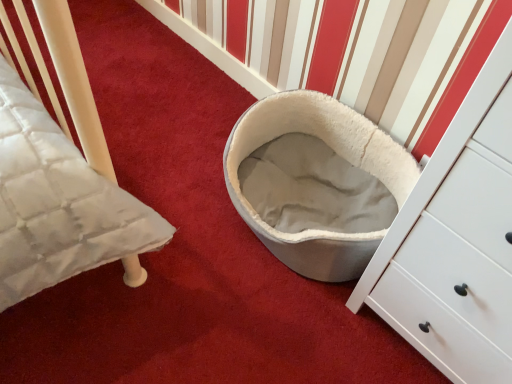
The width and height of the screenshot is (512, 384). What do you see at coordinates (339, 155) in the screenshot?
I see `white plush pet bed at center` at bounding box center [339, 155].

The image size is (512, 384). In order to click on white plush pet bed at center in this screenshot , I will do `click(339, 155)`.

At what (x,y) coordinates should I click in order to perform the action: click on white plush pet bed at center. Please return your answer as a coordinate pair (x, y). Image resolution: width=512 pixels, height=384 pixels. Looking at the image, I should click on (339, 155).